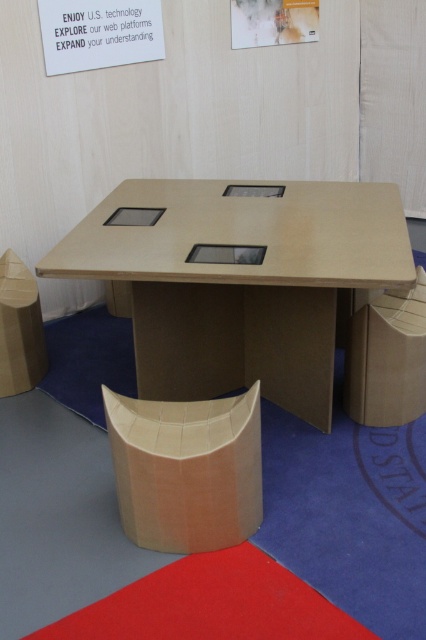
Question: Can you confirm if matte cardboard box at center is positioned to the left of matte cardboard box at left?

Choices:
 (A) yes
 (B) no

Answer: (B)

Question: Which of the following is the farthest from the observer?

Choices:
 (A) (157, 312)
 (B) (65, 10)

Answer: (B)

Question: Can you confirm if matte cardboard table at center is positioned below white paper at upper center?

Choices:
 (A) yes
 (B) no

Answer: (A)

Question: Which point is closer to the camera?

Choices:
 (A) matte cardboard box at right
 (B) matte white paper at upper center
 (C) matte cardboard table at center
 (D) matte cardboard box at left

Answer: (C)

Question: Which point appears farthest from the camera in this image?

Choices:
 (A) (397, 349)
 (B) (161, 406)

Answer: (A)

Question: Observing the image, what is the correct spatial positioning of white paper at upper center in reference to matte white paper at upper center?

Choices:
 (A) left
 (B) right

Answer: (A)